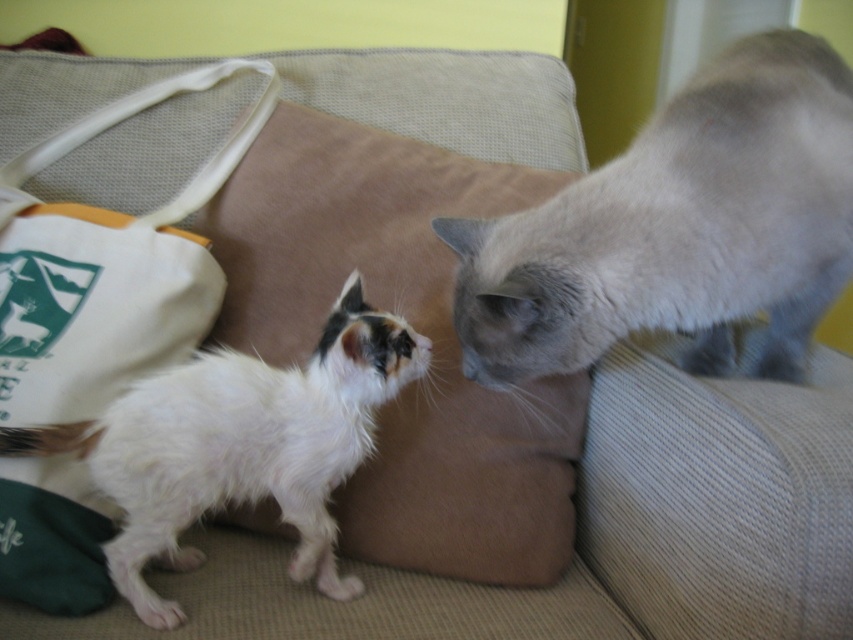
Between point (602, 170) and point (225, 173), which one is positioned behind?

The point (225, 173) is behind.

Where is `gray silky cat at upper right`? The width and height of the screenshot is (853, 640). gray silky cat at upper right is located at coordinates (677, 228).

Which is below, gray silky cat at upper right or white fluffy cat at left?

white fluffy cat at left

Is point (653, 189) positioned after point (248, 365)?

No.

I want to click on gray silky cat at upper right, so click(677, 228).

Locate an element on the screen. gray silky cat at upper right is located at coordinates (677, 228).

Does white canvas bag at left have a smaller size compared to canvas bag at upper left?

No.

Does white canvas bag at left have a lesser height compared to canvas bag at upper left?

No, white canvas bag at left is not shorter than canvas bag at upper left.

Is point (241, 68) positioned after point (366, 120)?

No, (241, 68) is in front of (366, 120).

The image size is (853, 640). I want to click on white canvas bag at left, so click(x=105, y=269).